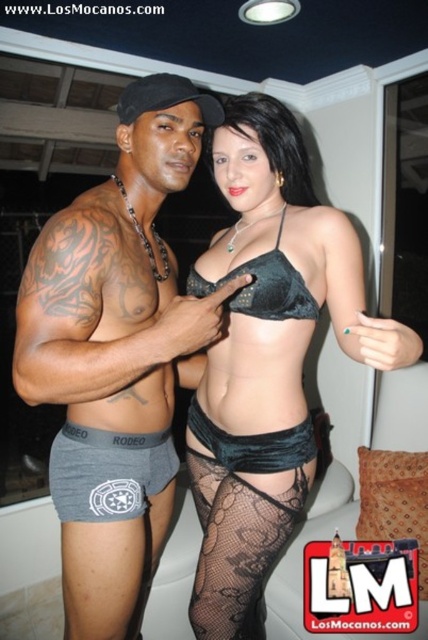
Does gray cotton underwear at center lie in front of black lace stockings at lower center?

Yes, it is.

Image resolution: width=428 pixels, height=640 pixels. I want to click on gray cotton underwear at center, so click(118, 353).

This screenshot has width=428, height=640. I want to click on gray cotton underwear at center, so click(118, 353).

Does black lace stockings at lower center have a greater width compared to velvet black bikini top at center?

Indeed, black lace stockings at lower center has a greater width compared to velvet black bikini top at center.

Who is more forward, (273, 547) or (262, 259)?

Point (262, 259)

What are the coordinates of `black lace stockings at lower center` in the screenshot? It's located at (237, 547).

Measure the distance between black lace stockings at lower center and camera.

1.23 meters

Does black lace stockings at lower center have a lesser height compared to gray cotton boxer briefs at lower left?

In fact, black lace stockings at lower center may be taller than gray cotton boxer briefs at lower left.

You are a GUI agent. You are given a task and a screenshot of the screen. Output one action in this format:
    pyautogui.click(x=<x>, y=<y>)
    Task: Click on the black lace stockings at lower center
    Image resolution: width=428 pixels, height=640 pixels.
    Given the screenshot: What is the action you would take?
    pyautogui.click(x=237, y=547)